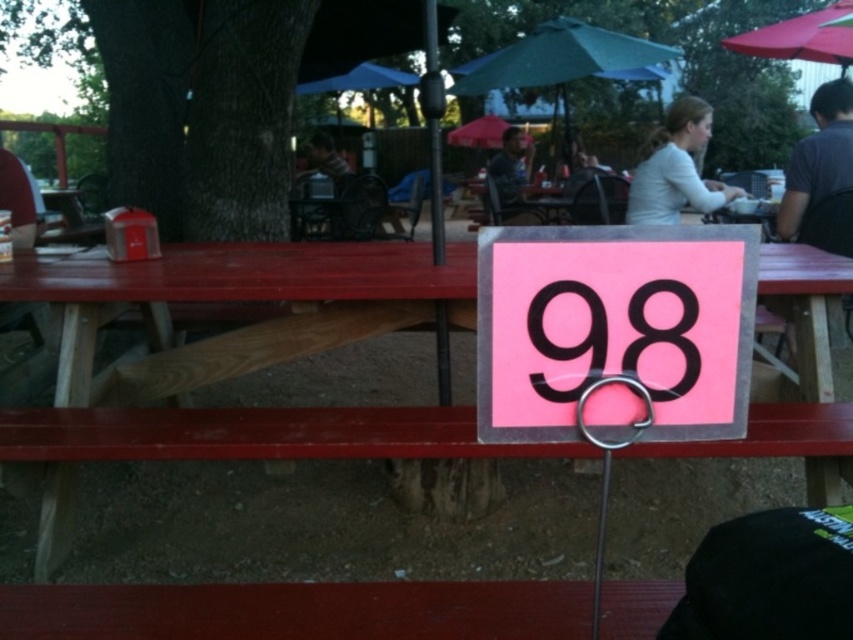
Question: Estimate the real-world distances between objects in this image. Which object is farther from the black fabric hat at lower right?

Choices:
 (A) white fabric shirt at upper center
 (B) matte black shirt at upper center
 (C) pink matte sign at center
 (D) matte black phone at center

Answer: (B)

Question: Can you confirm if matte black phone at center is smaller than matte black shirt at upper center?

Choices:
 (A) no
 (B) yes

Answer: (B)

Question: Among these points, which one is nearest to the camera?

Choices:
 (A) (677, 611)
 (B) (578, 390)
 (C) (372, 454)

Answer: (B)

Question: Based on their relative distances, which object is nearer to the matte black shirt at upper center?

Choices:
 (A) matte black phone at center
 (B) pink paper sign at center

Answer: (A)

Question: Can you confirm if green fabric umbrella at upper center is positioned above red fabric umbrella at upper right?

Choices:
 (A) yes
 (B) no

Answer: (A)

Question: Is black fabric hat at lower right further to camera compared to dark gray shirt at right?

Choices:
 (A) no
 (B) yes

Answer: (A)